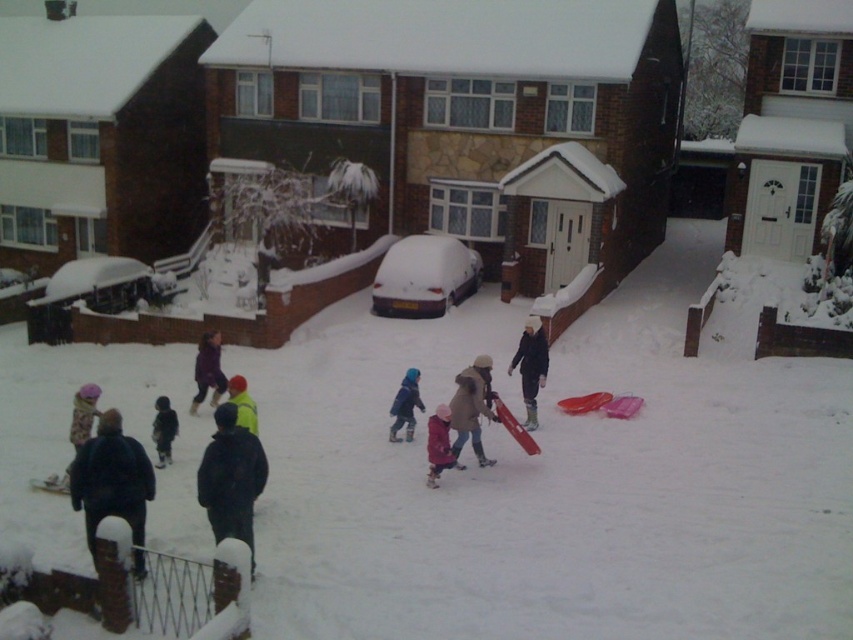
Question: Estimate the real-world distances between objects in this image. Which object is farther from the shiny yellow jacket at center?

Choices:
 (A) matte pink snowsuit at center
 (B) blue woolen hat at center
 (C) matte purple snowsuit at center

Answer: (C)

Question: Is matte pink snowsuit at center smaller than fluffy pink hat at center?

Choices:
 (A) no
 (B) yes

Answer: (A)

Question: Considering the real-world distances, which object is closest to the blue woolen hat at center?

Choices:
 (A) matte pink snowsuit at center
 (B) black matte jacket at lower left

Answer: (A)

Question: Based on their relative distances, which object is farther from the matte pink snowsuit at center?

Choices:
 (A) fluffy pink hat at center
 (B) matte purple snowsuit at center
 (C) dark gray jacket at lower left
 (D) brown fuzzy coat at center

Answer: (B)

Question: Is matte purple snowsuit at center bigger than fluffy pink hat at center?

Choices:
 (A) no
 (B) yes

Answer: (B)

Question: Observing the image, what is the correct spatial positioning of black matte jacket at lower center in reference to fluffy pink hat at center?

Choices:
 (A) above
 (B) below

Answer: (B)